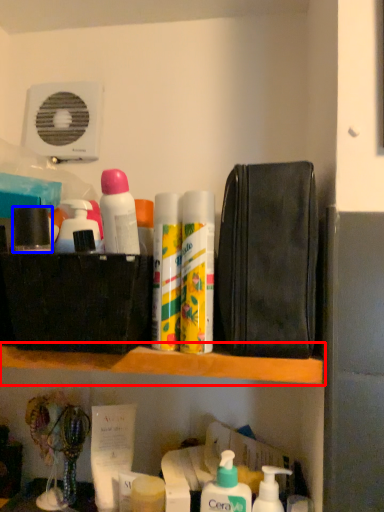
Question: Which object appears closest to the camera in this image, shelf (highlighted by a red box) or toiletry (highlighted by a blue box)?

Choices:
 (A) shelf
 (B) toiletry

Answer: (A)